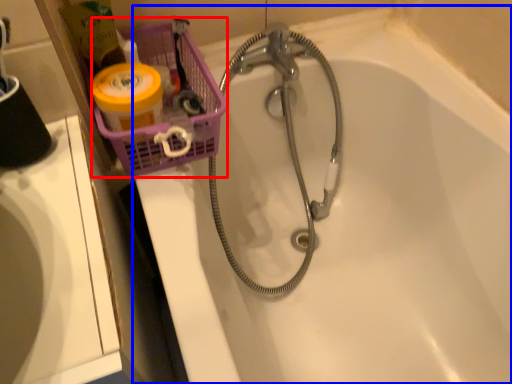
Question: Among these objects, which one is farthest to the camera, basket (highlighted by a red box) or bathtub (highlighted by a blue box)?

Choices:
 (A) basket
 (B) bathtub

Answer: (A)